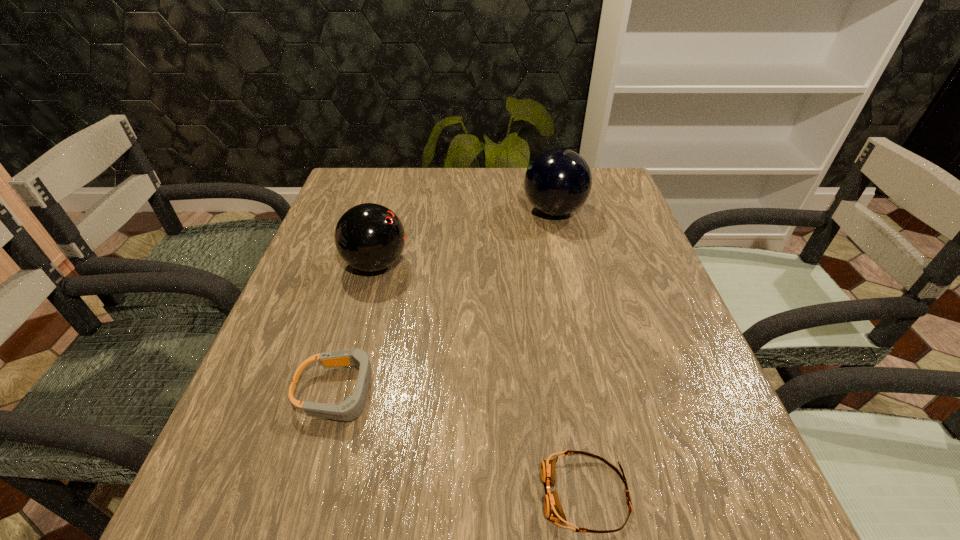
The image size is (960, 540). Identify the location of vacant region located on the side of the farther bowling ball with the finger holes. (503, 211).

You are a GUI agent. You are given a task and a screenshot of the screen. Output one action in this format:
    pyautogui.click(x=<x>, y=<y>)
    Task: Click on the blank space located 0.330m on the surface of the nearer bowling ball near the finger holes
    The height and width of the screenshot is (540, 960).
    Given the screenshot: What is the action you would take?
    pyautogui.click(x=551, y=264)

Where is `vacant space located 0.140m on the front and back of the farther goggles`? This screenshot has height=540, width=960. vacant space located 0.140m on the front and back of the farther goggles is located at coordinates (462, 392).

Locate an element on the screen. vacant space located with the lenses facing forward on the nearer goggles is located at coordinates pos(488,494).

Locate an element on the screen. The image size is (960, 540). free spot located 0.220m with the lenses facing forward on the nearer goggles is located at coordinates (391, 494).

What are the coordinates of `vacant point located 0.190m with the lenses facing forward on the nearer goggles` in the screenshot? It's located at (411, 494).

Locate an element on the screen. This screenshot has height=540, width=960. object present at the far edge is located at coordinates (558, 181).

Where is `object that is positioned at the near edge`? Image resolution: width=960 pixels, height=540 pixels. object that is positioned at the near edge is located at coordinates (553, 509).

Where is `bowling ball present at the left edge`? This screenshot has width=960, height=540. bowling ball present at the left edge is located at coordinates tap(370, 237).

You are a GUI agent. You are given a task and a screenshot of the screen. Output one action in this format:
    pyautogui.click(x=<x>, y=<y>)
    Task: Click on the goggles that is at the left edge
    The width and height of the screenshot is (960, 540).
    Given the screenshot: What is the action you would take?
    pyautogui.click(x=350, y=409)